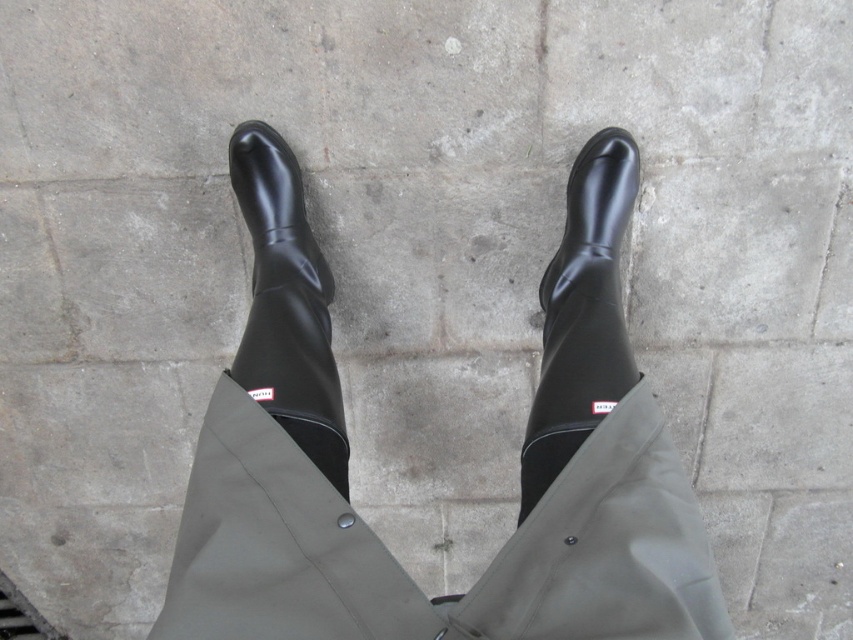
Does black rubber boot at center appear on the left side of shiny black boot at center?

No, black rubber boot at center is not to the left of shiny black boot at center.

Does black rubber boot at center have a smaller size compared to shiny black boot at center?

Yes, black rubber boot at center is smaller than shiny black boot at center.

Between point (608, 317) and point (247, 120), which one is positioned in front?

Point (608, 317)

This screenshot has width=853, height=640. Find the location of `black rubber boot at center`. black rubber boot at center is located at coordinates (582, 314).